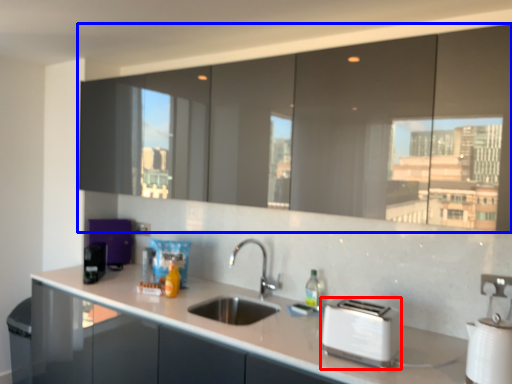
Question: Which of the following is the farthest to the observer, toaster (highlighted by a red box) or cabinetry (highlighted by a blue box)?

Choices:
 (A) toaster
 (B) cabinetry

Answer: (A)